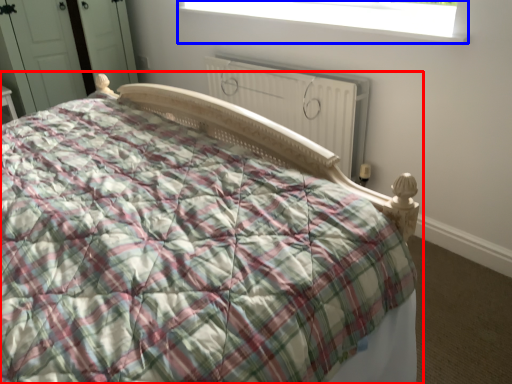
Question: Which object is further to the camera taking this photo, bed (highlighted by a red box) or window (highlighted by a blue box)?

Choices:
 (A) bed
 (B) window

Answer: (B)